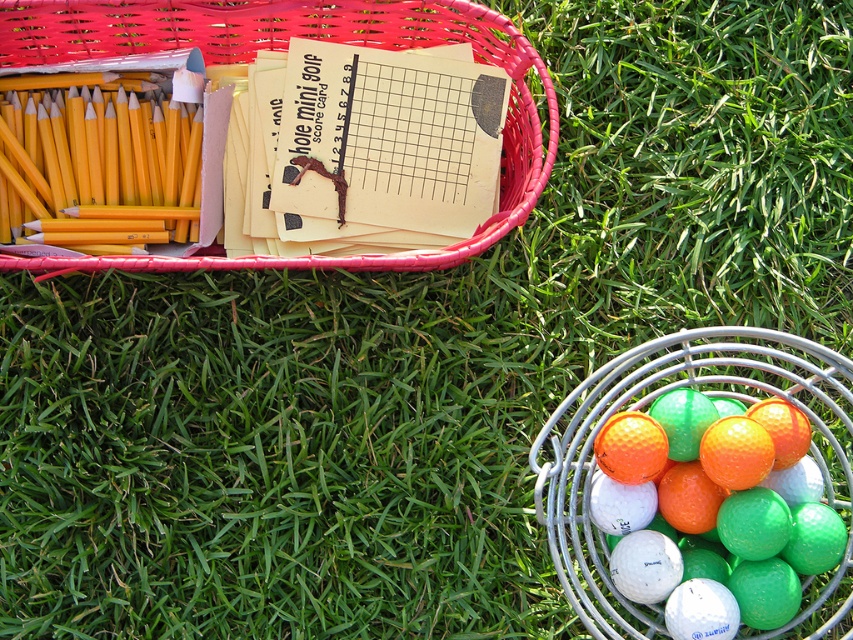
Can you confirm if matte plastic basket at upper left is bigger than white matte golf ball at lower right?

Yes, matte plastic basket at upper left is bigger than white matte golf ball at lower right.

Which of these two, matte plastic basket at upper left or white matte golf ball at lower right, stands shorter?

Standing shorter between the two is white matte golf ball at lower right.

Which is behind, point (517, 61) or point (711, 579)?

The point (517, 61) is more distant.

You are a GUI agent. You are given a task and a screenshot of the screen. Output one action in this format:
    pyautogui.click(x=<x>, y=<y>)
    Task: Click on the matte plastic basket at upper left
    The image size is (853, 640).
    Given the screenshot: What is the action you would take?
    pyautogui.click(x=280, y=51)

Can you confirm if matte plastic basket at upper left is bigger than rubberized plastic golf balls at right?

Yes, matte plastic basket at upper left is bigger than rubberized plastic golf balls at right.

Locate an element on the screen. matte plastic basket at upper left is located at coordinates (280, 51).

Can you confirm if rubberized plastic golf balls at right is smaller than white matte golf ball at lower right?

No.

Can you confirm if rubberized plastic golf balls at right is bigger than white matte golf ball at lower right?

Indeed, rubberized plastic golf balls at right has a larger size compared to white matte golf ball at lower right.

Does point (724, 372) lie in front of point (724, 614)?

That is False.

The width and height of the screenshot is (853, 640). What are the coordinates of `rubberized plastic golf balls at right` in the screenshot? It's located at (646, 408).